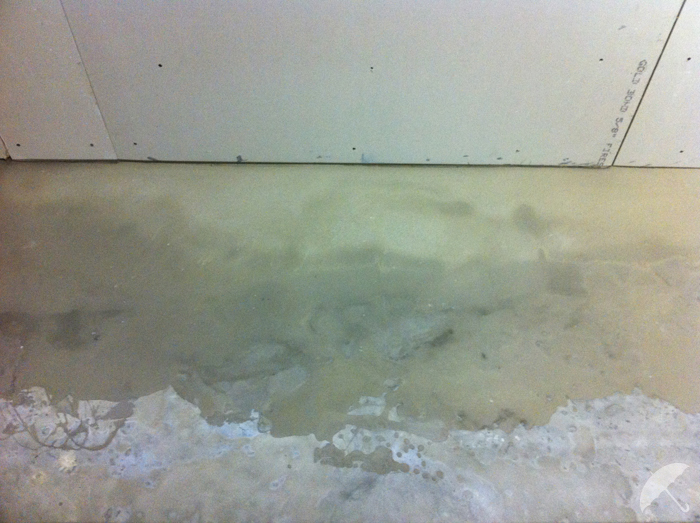
I want to click on circular mark on floor, so click(147, 485).